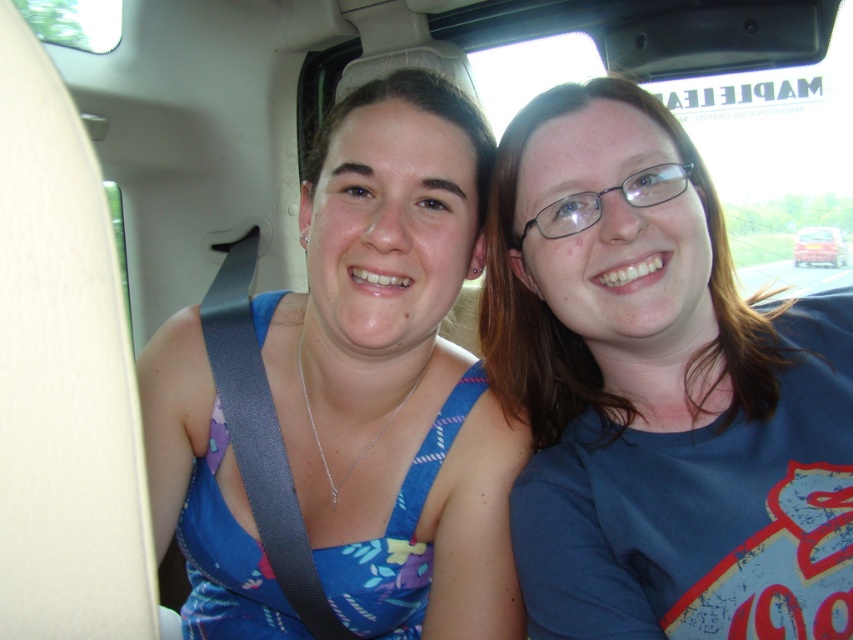
Question: Can you confirm if blue cotton shirt at center is positioned below blue fabric dress at center?

Choices:
 (A) yes
 (B) no

Answer: (B)

Question: Does blue cotton shirt at center lie behind metallic silver car at upper right?

Choices:
 (A) yes
 (B) no

Answer: (B)

Question: Which of these objects is positioned farthest from the blue fabric dress at center?

Choices:
 (A) blue cotton shirt at center
 (B) metallic silver car at upper right

Answer: (B)

Question: Among these objects, which one is farthest from the camera?

Choices:
 (A) metallic silver car at upper right
 (B) blue cotton shirt at center

Answer: (A)

Question: Is blue cotton shirt at center below metallic silver car at upper right?

Choices:
 (A) no
 (B) yes

Answer: (B)

Question: Among these objects, which one is nearest to the camera?

Choices:
 (A) blue cotton shirt at center
 (B) blue fabric dress at center
 (C) metallic silver car at upper right

Answer: (A)